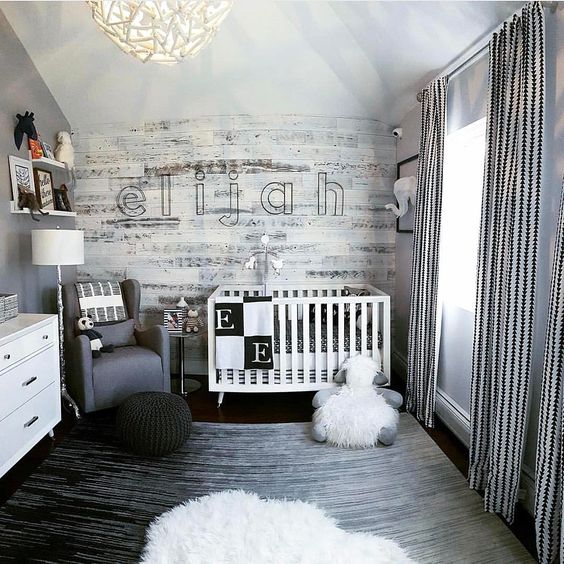
Where is `doll/toy`? This screenshot has width=564, height=564. doll/toy is located at coordinates (192, 318).